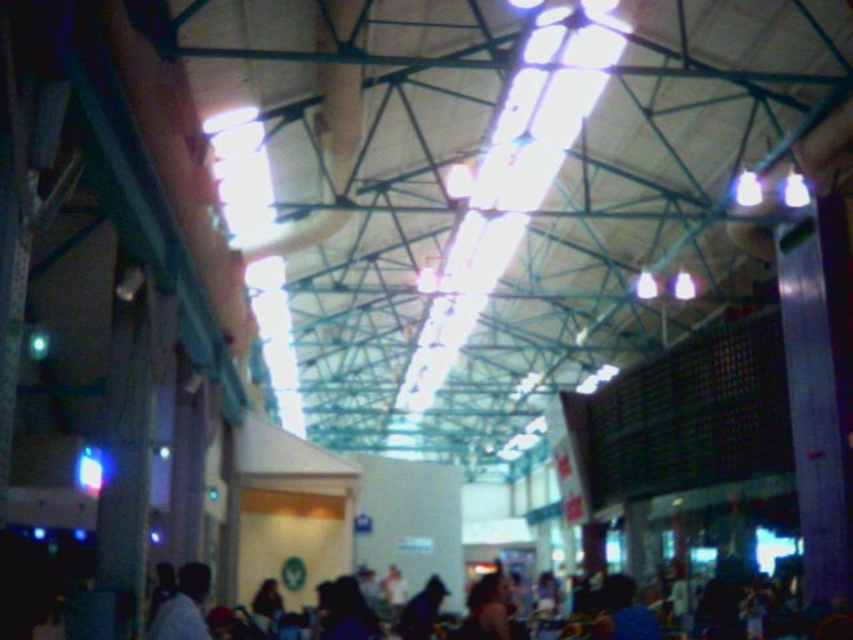
You are standing in the middle of the building and want to move towards the two points marked on the ceiling. Which point, the point at coordinates (194, 620) or the point at (480, 608), would you reach first if you walk directly towards them?

You would reach the point at coordinates (194, 620) first because it is closer to you than the point at (480, 608).

You are standing in the building and see the blue fabric shirt at lower left and the dark brown hair at lower center. Which object is nearer to you?

The blue fabric shirt at lower left is closer to the viewer than the dark brown hair at lower center.